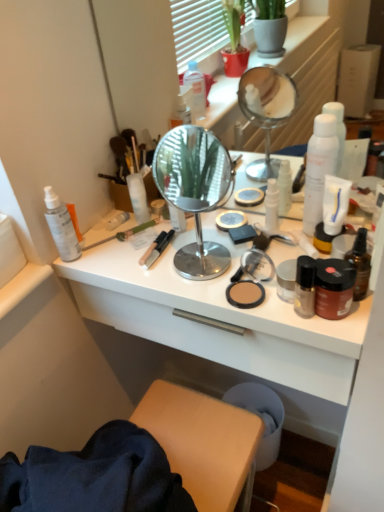
Locate an element on the screen. This screenshot has width=384, height=512. vacant space that's between white matte bottle at center, the 5th toiletry viewed from the right, and white matte spray can at right, which is the 2th bottle from bottom to top is located at coordinates 216,224.